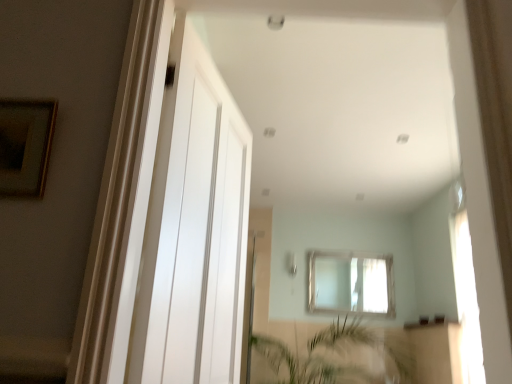
Question: From a real-world perspective, is green leafy plant at lower center on top of clear glass window at center?

Choices:
 (A) no
 (B) yes

Answer: (A)

Question: Does green leafy plant at lower center come behind clear glass window at center?

Choices:
 (A) yes
 (B) no

Answer: (B)

Question: From the image's perspective, would you say green leafy plant at lower center is positioned over clear glass window at center?

Choices:
 (A) yes
 (B) no

Answer: (B)

Question: Is green leafy plant at lower center turned away from clear glass window at center?

Choices:
 (A) yes
 (B) no

Answer: (B)

Question: Does green leafy plant at lower center have a smaller size compared to clear glass window at center?

Choices:
 (A) no
 (B) yes

Answer: (A)

Question: Can you confirm if green leafy plant at lower center is positioned to the right of clear glass window at center?

Choices:
 (A) yes
 (B) no

Answer: (B)

Question: Is wooden framed picture at upper left shorter than black glass window sill at lower center?

Choices:
 (A) yes
 (B) no

Answer: (B)

Question: Is wooden framed picture at upper left to the right of black glass window sill at lower center from the viewer's perspective?

Choices:
 (A) yes
 (B) no

Answer: (B)

Question: Is wooden framed picture at upper left behind black glass window sill at lower center?

Choices:
 (A) yes
 (B) no

Answer: (B)

Question: Is wooden framed picture at upper left in front of black glass window sill at lower center?

Choices:
 (A) no
 (B) yes

Answer: (B)

Question: Considering the relative sizes of wooden framed picture at upper left and black glass window sill at lower center in the image provided, is wooden framed picture at upper left wider than black glass window sill at lower center?

Choices:
 (A) yes
 (B) no

Answer: (B)

Question: Is there a large distance between wooden framed picture at upper left and black glass window sill at lower center?

Choices:
 (A) no
 (B) yes

Answer: (B)

Question: From the image's perspective, is black glass window sill at lower center over clear glass window at center?

Choices:
 (A) no
 (B) yes

Answer: (A)